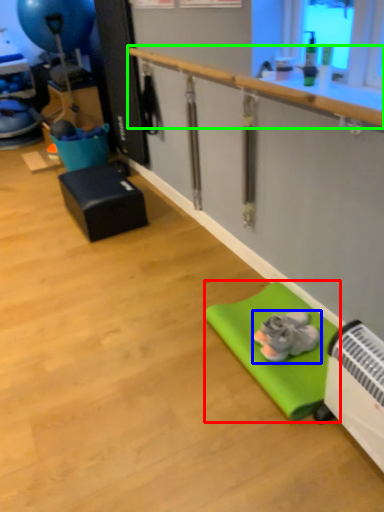
Question: Which object is positioned closest to yoga mat (highlighted by a red box)? Select from footwear (highlighted by a blue box) and rail (highlighted by a green box).

Choices:
 (A) footwear
 (B) rail

Answer: (A)